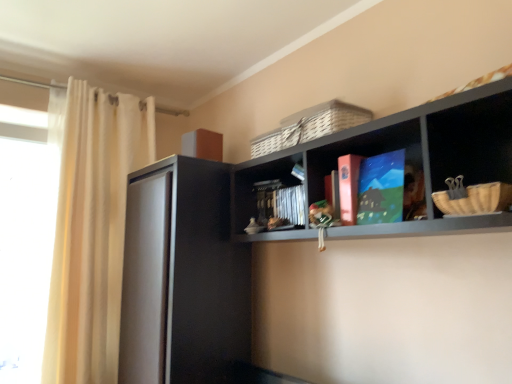
Question: From the image's perspective, is matte cardboard book at center, placed as the 2th book when sorted from back to front, beneath black matte cabinet at left?

Choices:
 (A) no
 (B) yes

Answer: (A)

Question: Is matte cardboard book at center, the second book in the front-to-back sequence, not near black matte cabinet at left?

Choices:
 (A) yes
 (B) no

Answer: (B)

Question: Is matte cardboard book at center, placed as the 2th book when sorted from back to front, bigger than black matte cabinet at left?

Choices:
 (A) no
 (B) yes

Answer: (A)

Question: Is matte cardboard book at center, placed as the 2th book when sorted from back to front, further to camera compared to black matte cabinet at left?

Choices:
 (A) no
 (B) yes

Answer: (A)

Question: From a real-world perspective, is matte cardboard book at center, placed as the 2th book when sorted from back to front, under black matte cabinet at left?

Choices:
 (A) yes
 (B) no

Answer: (B)

Question: Is transparent glass window at left inside or outside of matte blue book at center, which is the third book from back to front?

Choices:
 (A) inside
 (B) outside

Answer: (B)

Question: Considering their positions, is transparent glass window at left located in front of or behind matte blue book at center, which is the third book from back to front?

Choices:
 (A) behind
 (B) front

Answer: (A)

Question: Considering the positions of transparent glass window at left and matte blue book at center, marked as the 1th book in a front-to-back arrangement, in the image, is transparent glass window at left wider or thinner than matte blue book at center, marked as the 1th book in a front-to-back arrangement,?

Choices:
 (A) thin
 (B) wide

Answer: (B)

Question: From the image's perspective, is transparent glass window at left positioned above or below matte blue book at center, marked as the 1th book in a front-to-back arrangement?

Choices:
 (A) below
 (B) above

Answer: (A)

Question: From a real-world perspective, relative to white sheer curtain at left, is matte black shelf at upper center vertically above or below?

Choices:
 (A) below
 (B) above

Answer: (B)

Question: Is matte black shelf at upper center inside the boundaries of white sheer curtain at left, or outside?

Choices:
 (A) inside
 (B) outside

Answer: (B)

Question: Is point pyautogui.click(x=327, y=165) closer or farther from the camera than point pyautogui.click(x=121, y=107)?

Choices:
 (A) farther
 (B) closer

Answer: (B)

Question: Considering their positions, is matte black shelf at upper center located in front of or behind white sheer curtain at left?

Choices:
 (A) front
 (B) behind

Answer: (A)

Question: Considering the positions of point (343, 193) and point (376, 162), is point (343, 193) closer or farther from the camera than point (376, 162)?

Choices:
 (A) farther
 (B) closer

Answer: (A)

Question: Looking at the image, does matte cardboard book at center, placed as the 2th book when sorted from back to front, seem bigger or smaller compared to matte blue book at center, marked as the 1th book in a front-to-back arrangement?

Choices:
 (A) big
 (B) small

Answer: (A)